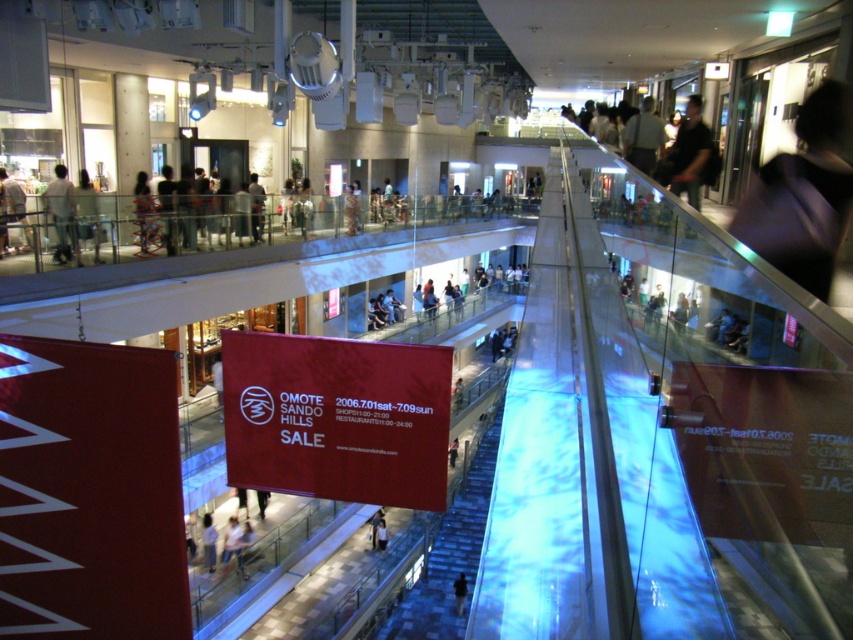
Question: Which point is farther to the camera?

Choices:
 (A) light brown leather jacket at upper left
 (B) translucent glass escalator at center

Answer: (B)

Question: Which point appears closest to the camera in this image?

Choices:
 (A) (393, 330)
 (B) (54, 260)

Answer: (B)

Question: Based on their relative distances, which object is farther from the dark blue fabric at center?

Choices:
 (A) light blue jeans at upper center
 (B) translucent glass escalator at center

Answer: (A)

Question: Is light brown leather jacket at upper left to the left of dark blue fabric at center from the viewer's perspective?

Choices:
 (A) yes
 (B) no

Answer: (A)

Question: Does translucent glass escalator at center appear under light blue jeans at upper center?

Choices:
 (A) yes
 (B) no

Answer: (A)

Question: Is translucent glass escalator at center bigger than light brown leather jacket at lower center?

Choices:
 (A) no
 (B) yes

Answer: (B)